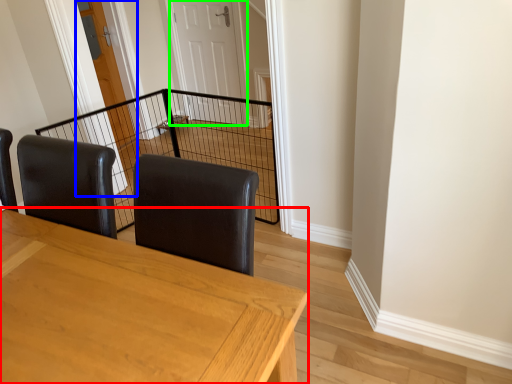
Question: Considering the real-world distances, which object is closest to table (highlighted by a red box)? door (highlighted by a blue box) or door (highlighted by a green box).

Choices:
 (A) door
 (B) door

Answer: (A)